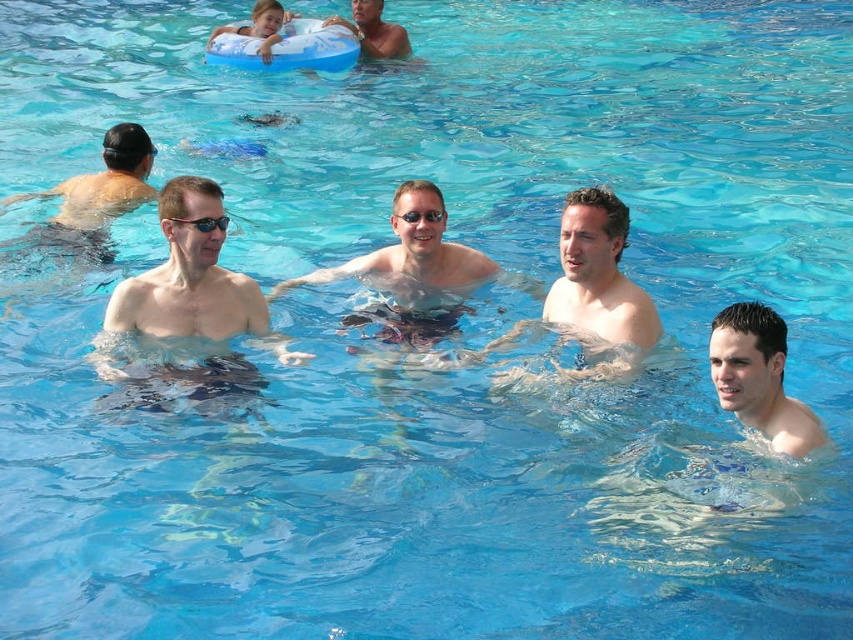
Question: Estimate the real-world distances between objects in this image. Which object is closer to the smooth skin man at center?

Choices:
 (A) smooth skin man at left
 (B) smooth tan skin at upper center

Answer: (A)

Question: Is smooth skin man at lower right below glossy plastic goggles at center?

Choices:
 (A) no
 (B) yes

Answer: (B)

Question: Observing the image, what is the correct spatial positioning of smooth skin man at center in reference to matte black swim cap at left?

Choices:
 (A) above
 (B) below

Answer: (B)

Question: Can you confirm if smooth blue float at upper left is thinner than black plastic goggles at left?

Choices:
 (A) no
 (B) yes

Answer: (A)

Question: Which point is farther to the camera?

Choices:
 (A) click(x=270, y=42)
 (B) click(x=123, y=371)
 (C) click(x=379, y=28)
 (D) click(x=640, y=342)

Answer: (C)

Question: Among these objects, which one is farthest from the camera?

Choices:
 (A) smooth tan skin at upper center
 (B) black plastic goggles at left
 (C) smooth skin man at center
 (D) matte black swim cap at left

Answer: (A)